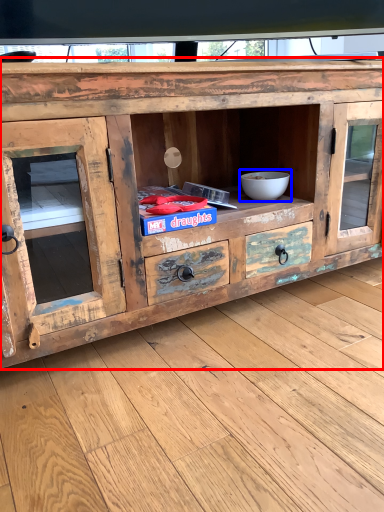
Question: Which of the following is the farthest to the observer, chest of drawers (highlighted by a red box) or bowl (highlighted by a blue box)?

Choices:
 (A) chest of drawers
 (B) bowl

Answer: (B)